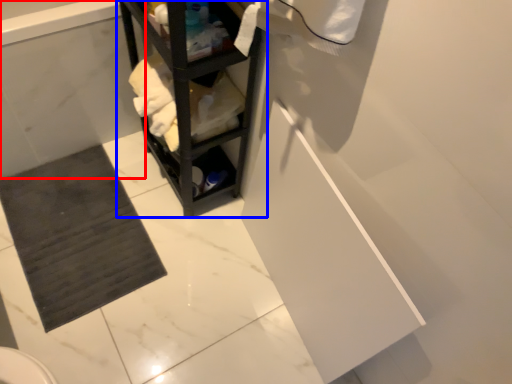
Question: Which object appears closest to the camera in this image, bath (highlighted by a red box) or shelf (highlighted by a blue box)?

Choices:
 (A) bath
 (B) shelf

Answer: (B)